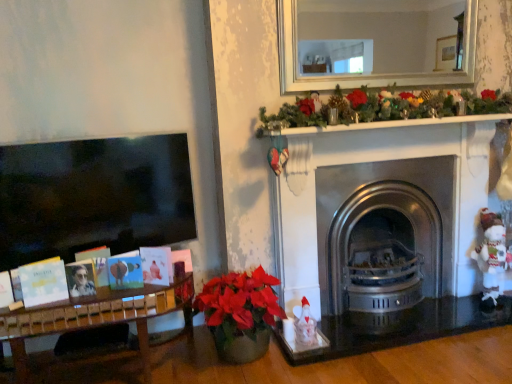
Question: Considering the relative positions of white knitted toy at right and matte black photo frame at left in the image provided, is white knitted toy at right to the right of matte black photo frame at left from the viewer's perspective?

Choices:
 (A) yes
 (B) no

Answer: (A)

Question: From a real-world perspective, does white knitted toy at right stand above matte black photo frame at left?

Choices:
 (A) yes
 (B) no

Answer: (B)

Question: Considering the relative sizes of white knitted toy at right and matte black photo frame at left in the image provided, is white knitted toy at right thinner than matte black photo frame at left?

Choices:
 (A) no
 (B) yes

Answer: (A)

Question: Is white knitted toy at right smaller than matte black photo frame at left?

Choices:
 (A) no
 (B) yes

Answer: (A)

Question: Can you confirm if white knitted toy at right is positioned to the left of matte black photo frame at left?

Choices:
 (A) no
 (B) yes

Answer: (A)

Question: From a real-world perspective, relative to polished stainless steel fireplace at center, is white knitted toy at right vertically above or below?

Choices:
 (A) above
 (B) below

Answer: (B)

Question: Is white knitted toy at right in front of or behind polished stainless steel fireplace at center in the image?

Choices:
 (A) front
 (B) behind

Answer: (B)

Question: Is white knitted toy at right to the left or to the right of polished stainless steel fireplace at center in the image?

Choices:
 (A) right
 (B) left

Answer: (A)

Question: In terms of height, does white knitted toy at right look taller or shorter compared to polished stainless steel fireplace at center?

Choices:
 (A) tall
 (B) short

Answer: (B)

Question: Is matte black photo frame at left situated inside polished stainless steel fireplace at center or outside?

Choices:
 (A) outside
 (B) inside

Answer: (A)

Question: Based on their sizes in the image, would you say matte black photo frame at left is bigger or smaller than polished stainless steel fireplace at center?

Choices:
 (A) small
 (B) big

Answer: (A)

Question: Is matte black photo frame at left in front of or behind polished stainless steel fireplace at center in the image?

Choices:
 (A) behind
 (B) front

Answer: (B)

Question: Considering the positions of matte black photo frame at left and polished stainless steel fireplace at center in the image, is matte black photo frame at left taller or shorter than polished stainless steel fireplace at center?

Choices:
 (A) short
 (B) tall

Answer: (A)

Question: Is matte black photo frame at left spatially inside white knitted toy at right, or outside of it?

Choices:
 (A) inside
 (B) outside

Answer: (B)

Question: Visually, is matte black photo frame at left positioned to the left or to the right of white knitted toy at right?

Choices:
 (A) left
 (B) right

Answer: (A)